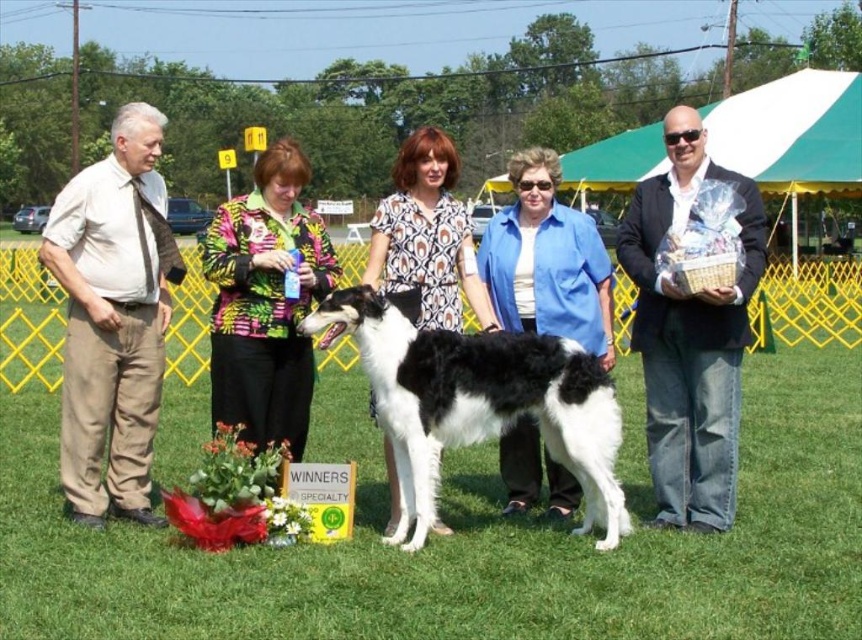
You are standing at the starting line looking towards the finish line. There are two points marked on the field. The first point is at coordinates point (130, 509) and the second point is at point (620, 496). Which point is closer to the finish line?

Point (130, 509) is behind point (620, 496), so the point closer to the finish line is point (620, 496).

In the scene shown: You are a photographer at the dog show and need to ensure all participants are visible in the photo. The beige cotton pants at left and denim jacket at right are part of two different participants. Considering their heights, which participant should you position closer to the camera to ensure both are fully visible?

The beige cotton pants at left is much taller than the denim jacket at right. To ensure both participants are fully visible in the photo, position the denim jacket at right closer to the camera since the taller participant can be placed slightly behind.